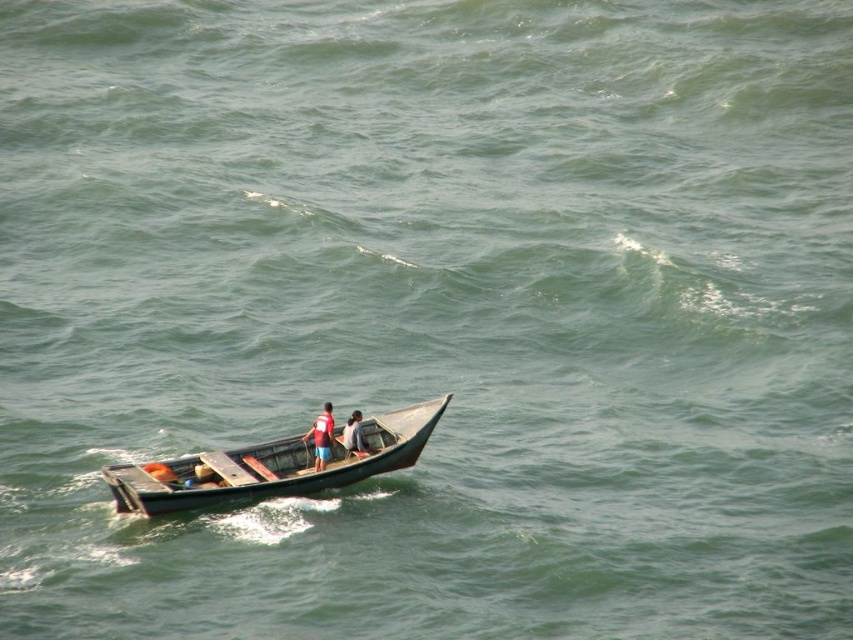
Who is more distant from viewer, (329, 413) or (360, 419)?

Point (360, 419)

Who is higher up, matte red life vest at center or red fabric shirt at center?

red fabric shirt at center is above.

Between point (312, 440) and point (357, 416), which one is positioned in front?

Point (357, 416) is more forward.

Find the location of a particular element. This screenshot has width=853, height=640. matte red life vest at center is located at coordinates (321, 436).

Is wooden boat at center thinner than red fabric shirt at center?

In fact, wooden boat at center might be wider than red fabric shirt at center.

Image resolution: width=853 pixels, height=640 pixels. What are the coordinates of `wooden boat at center` in the screenshot? It's located at (270, 467).

Locate an element on the screen. The image size is (853, 640). wooden boat at center is located at coordinates (270, 467).

Which of these two, wooden boat at center or matte red life vest at center, stands shorter?

matte red life vest at center

Who is lower down, wooden boat at center or matte red life vest at center?

Positioned lower is wooden boat at center.

Does point (131, 467) come in front of point (314, 419)?

Yes, it is.

Locate an element on the screen. The image size is (853, 640). wooden boat at center is located at coordinates (270, 467).